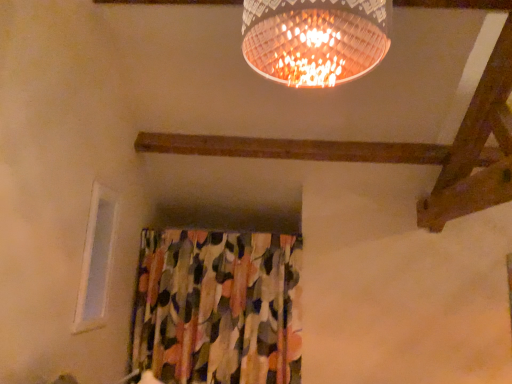
Question: Is white plastic window at upper left a part of textured floral fabric at center?

Choices:
 (A) yes
 (B) no

Answer: (B)

Question: Is textured floral fabric at center wider than white plastic window at upper left?

Choices:
 (A) yes
 (B) no

Answer: (A)

Question: From the image's perspective, is textured floral fabric at center over white plastic window at upper left?

Choices:
 (A) no
 (B) yes

Answer: (A)

Question: Is textured floral fabric at center to the right of white plastic window at upper left from the viewer's perspective?

Choices:
 (A) no
 (B) yes

Answer: (B)

Question: Considering the relative sizes of textured floral fabric at center and white plastic window at upper left in the image provided, is textured floral fabric at center taller than white plastic window at upper left?

Choices:
 (A) yes
 (B) no

Answer: (A)

Question: Is textured floral fabric at center positioned with its back to white plastic window at upper left?

Choices:
 (A) yes
 (B) no

Answer: (B)

Question: Is white plastic window at upper left closer to the viewer compared to textured floral fabric at center?

Choices:
 (A) yes
 (B) no

Answer: (A)

Question: From a real-world perspective, is white plastic window at upper left on top of textured floral fabric at center?

Choices:
 (A) yes
 (B) no

Answer: (A)

Question: Can you confirm if white plastic window at upper left is smaller than textured floral fabric at center?

Choices:
 (A) yes
 (B) no

Answer: (A)

Question: From the image's perspective, is white plastic window at upper left above textured floral fabric at center?

Choices:
 (A) yes
 (B) no

Answer: (A)

Question: Is white plastic window at upper left positioned beyond the bounds of textured floral fabric at center?

Choices:
 (A) yes
 (B) no

Answer: (A)

Question: Is white plastic window at upper left oriented away from textured floral fabric at center?

Choices:
 (A) yes
 (B) no

Answer: (B)

Question: In the image, is white plastic window at upper left positioned in front of or behind textured floral fabric at center?

Choices:
 (A) front
 (B) behind

Answer: (A)